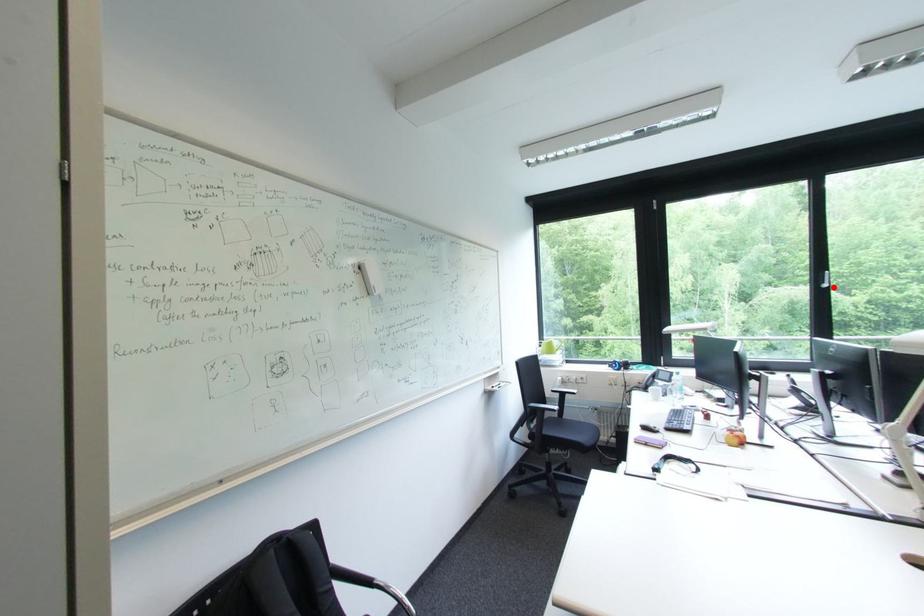
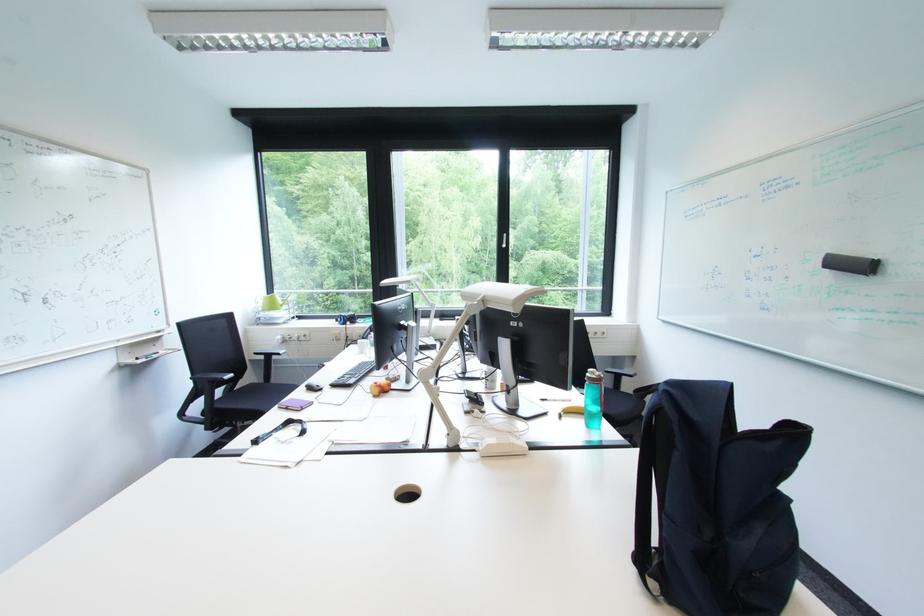
In the second image, find the point that corresponds to the highlighted location in the first image.

(514, 248)